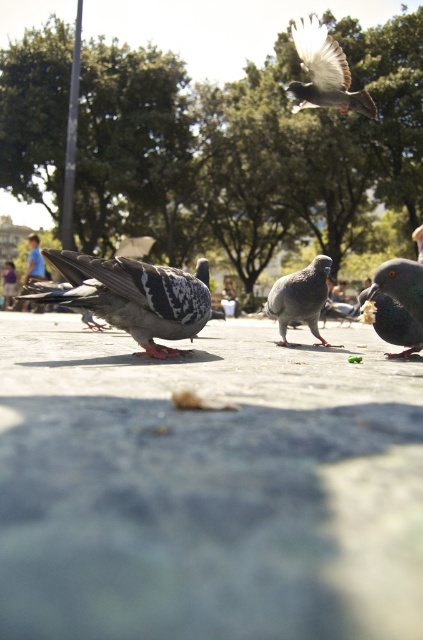
Question: Which point is farther to the camera?

Choices:
 (A) shiny dark gray pigeon at lower right
 (B) gray concrete pavement at center

Answer: (A)

Question: Which of the following is the closest to the observer?

Choices:
 (A) (46, 284)
 (B) (406, 323)

Answer: (B)

Question: Is speckled feathered pigeons at center below speckled feathered bird at upper center?

Choices:
 (A) yes
 (B) no

Answer: (A)

Question: Which of these objects is positioned farthest from the gray speckled pigeon at center?

Choices:
 (A) shiny dark gray pigeon at lower right
 (B) speckled feathered pigeon at center
 (C) gray concrete pavement at center
 (D) speckled feathered pigeons at center

Answer: (B)

Question: Can you confirm if speckled feathered pigeons at center is thinner than speckled feathered bird at upper center?

Choices:
 (A) yes
 (B) no

Answer: (A)

Question: Does shiny dark gray pigeon at lower right appear under gray speckled pigeon at center?

Choices:
 (A) yes
 (B) no

Answer: (A)